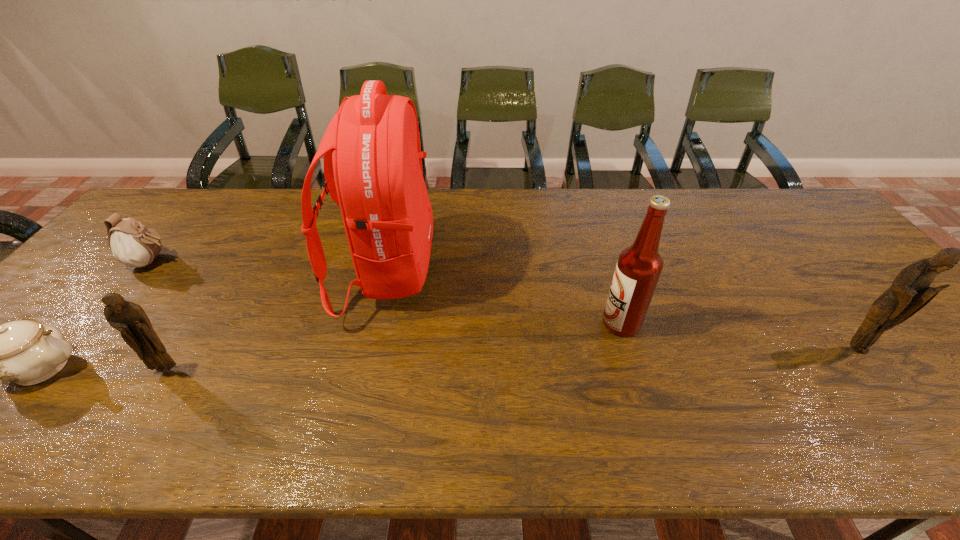
In the image, there is a desktop. In order to click on vacant space at the near left corner in this screenshot , I will do `click(56, 378)`.

Find the location of a particular element. The width and height of the screenshot is (960, 540). free space between the third object from right to left and the pouch is located at coordinates (269, 267).

Where is `empty location between the shorter figurine and the rightmost object`? The width and height of the screenshot is (960, 540). empty location between the shorter figurine and the rightmost object is located at coordinates tap(512, 359).

Identify the location of empty space that is in between the third shortest object and the fifth object from left to right. coord(395,347).

The image size is (960, 540). I want to click on free space between the fourth shortest object and the shorter figurine, so click(x=512, y=359).

Find the location of `vacant area between the pouch and the shorter figurine`. vacant area between the pouch and the shorter figurine is located at coordinates (159, 316).

Identify the location of blank region between the third object from right to left and the pouch. (269, 267).

Where is `the third closest object to the taller figurine`? This screenshot has width=960, height=540. the third closest object to the taller figurine is located at coordinates (130, 319).

This screenshot has width=960, height=540. Identify the location of object that is the fourth closest to the tallest object. (26, 352).

This screenshot has width=960, height=540. What are the coordinates of `free spot that satisfies the following two spatial constraints: 1. on the main compartment of the third object from right to left; 2. on the front-facing side of the shorter figurine` in the screenshot? It's located at (363, 370).